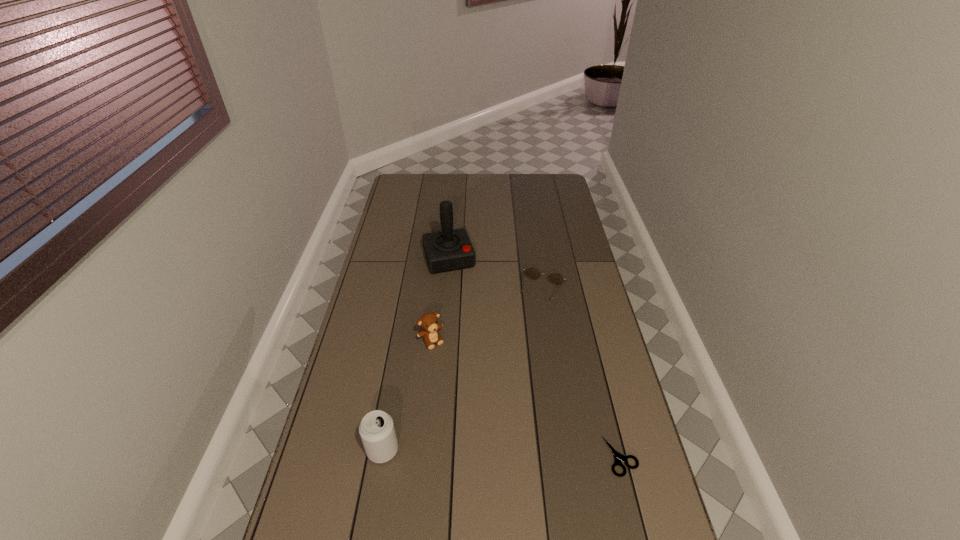
Find the location of a particular element. Image resolution: width=960 pixels, height=540 pixels. vacant region that satisfies the following two spatial constraints: 1. on the front side of the rightmost object; 2. on the left side of the joystick is located at coordinates 432,456.

The image size is (960, 540). What are the coordinates of `vacant space that satisfies the following two spatial constraints: 1. on the front side of the shears; 2. on the right side of the spectacles` in the screenshot? It's located at (570, 456).

What are the coordinates of `free location that satisfies the following two spatial constraints: 1. on the front side of the joystick; 2. on the left side of the fourth nearest object` in the screenshot? It's located at (446, 291).

Find the location of a particular element. The image size is (960, 540). vacant space that satisfies the following two spatial constraints: 1. on the back side of the can; 2. on the left side of the tallest object is located at coordinates (416, 259).

Where is `vacant space that satisfies the following two spatial constraints: 1. on the front side of the second farthest object; 2. on the left side of the shortest object`? The width and height of the screenshot is (960, 540). vacant space that satisfies the following two spatial constraints: 1. on the front side of the second farthest object; 2. on the left side of the shortest object is located at coordinates (570, 456).